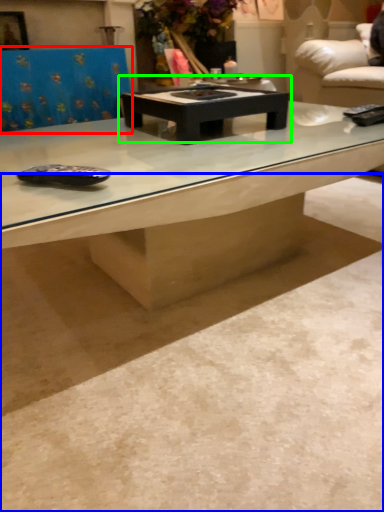
Question: Which object is the closest to the swivel chair (highlighted by a red box)? Choose among these: concrete (highlighted by a blue box) or coffee table (highlighted by a green box).

Choices:
 (A) concrete
 (B) coffee table

Answer: (B)